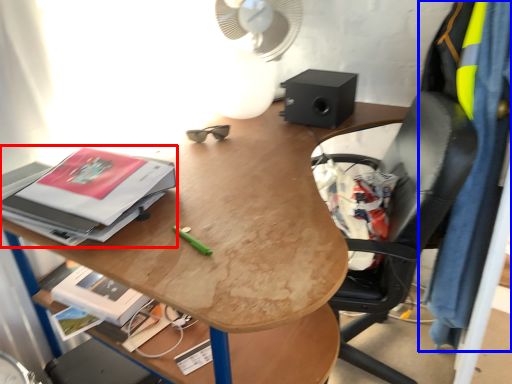
Question: Which object is closer to the camera taking this photo, paperback book (highlighted by a red box) or clothing (highlighted by a blue box)?

Choices:
 (A) paperback book
 (B) clothing

Answer: (A)